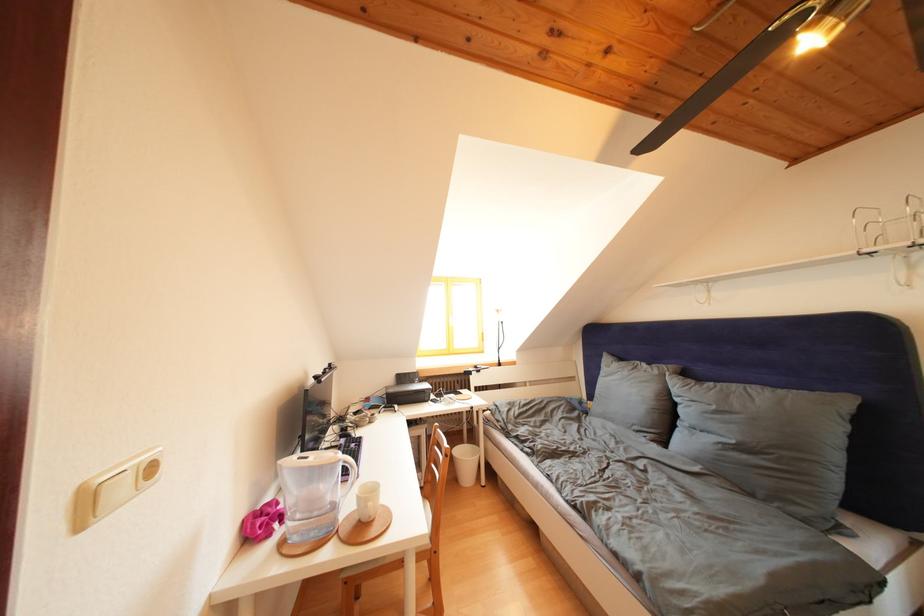
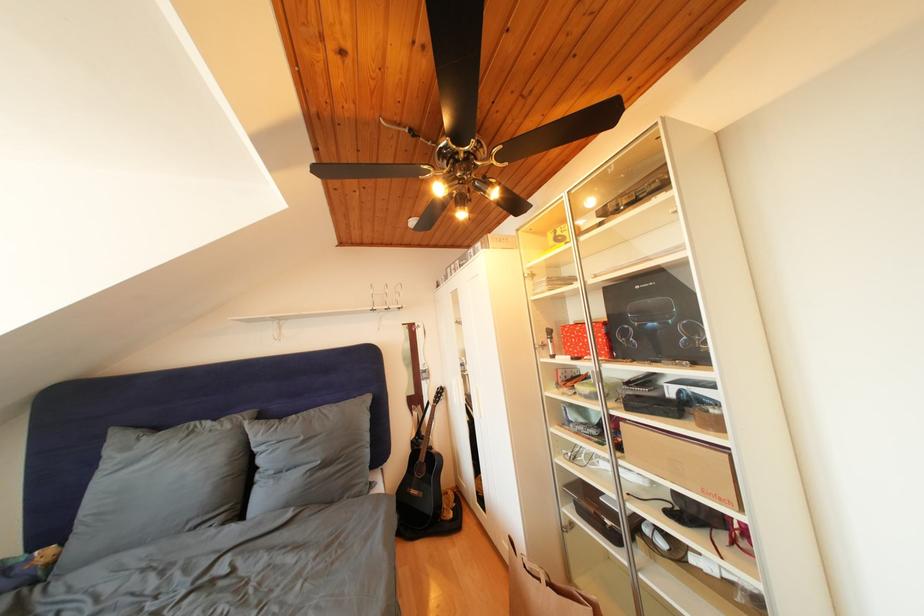
Find the pixel in the second image that matches the point at 722,411 in the first image.

(310, 444)